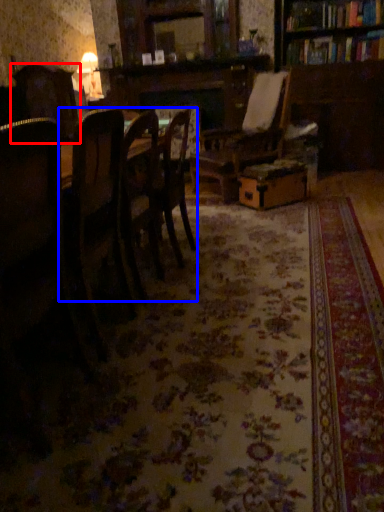
Question: Which object is further to the camera taking this photo, chair (highlighted by a red box) or kitchen & dining room table (highlighted by a blue box)?

Choices:
 (A) chair
 (B) kitchen & dining room table

Answer: (A)